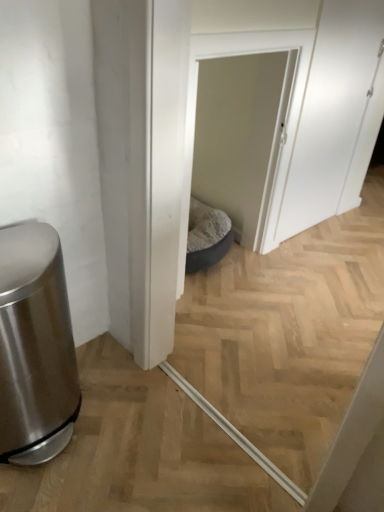
At what (x,y) coordinates should I click in order to perform the action: click on free space in front of white fabric pet bed at center, arranged as the 1th screen door when viewed from the left. Please return your answer as a coordinate pair (x, y). Looking at the image, I should click on (239, 320).